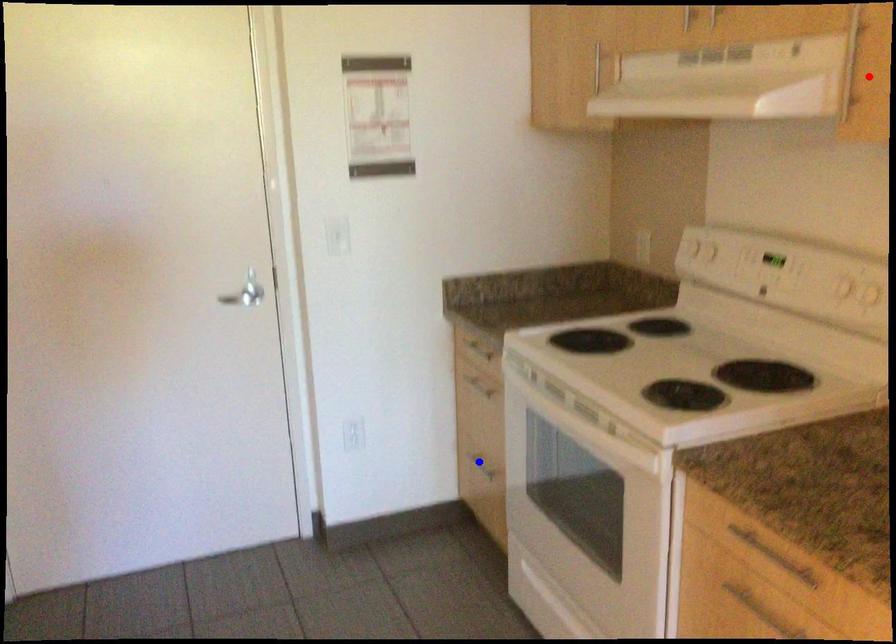
Question: Which of the two points in the image is closer to the camera?

Choices:
 (A) Blue point is closer.
 (B) Red point is closer.

Answer: (B)